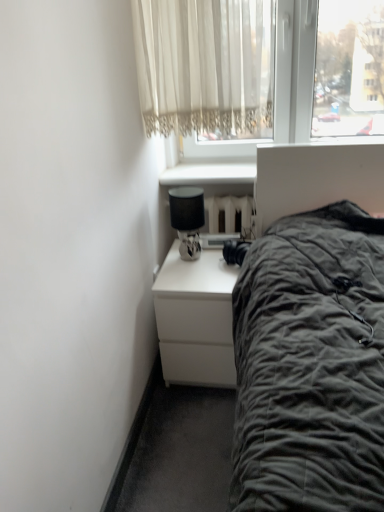
The width and height of the screenshot is (384, 512). What are the coordinates of `free space above white matte nightstand at lower center (from a real-world perspective)` in the screenshot? It's located at (213, 251).